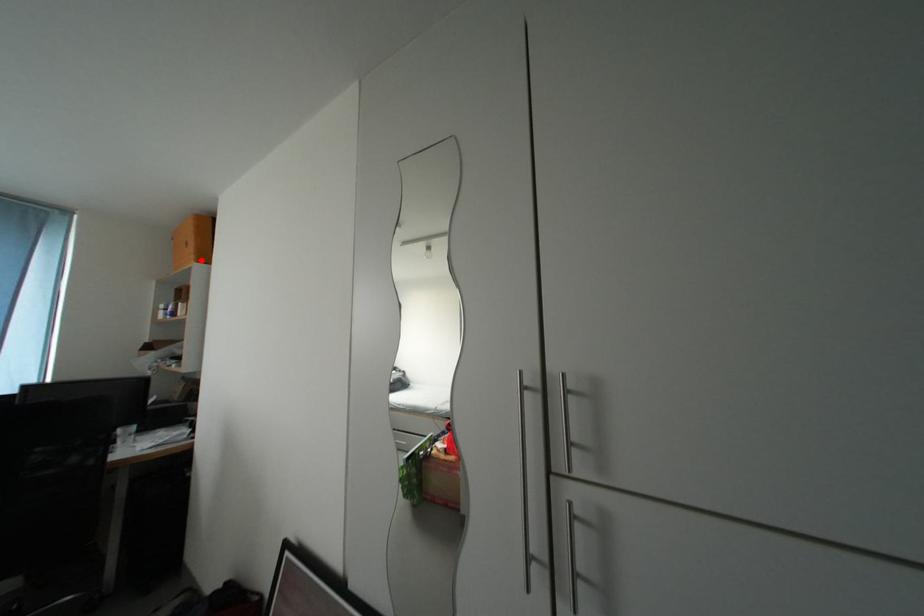
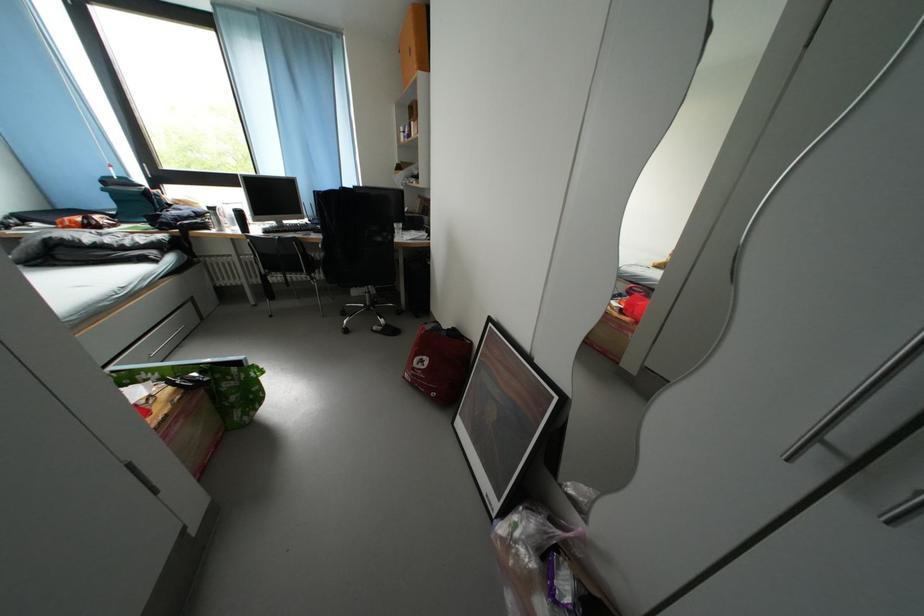
Locate, in the second image, the point that corresponds to the highlighted location in the first image.

(423, 71)